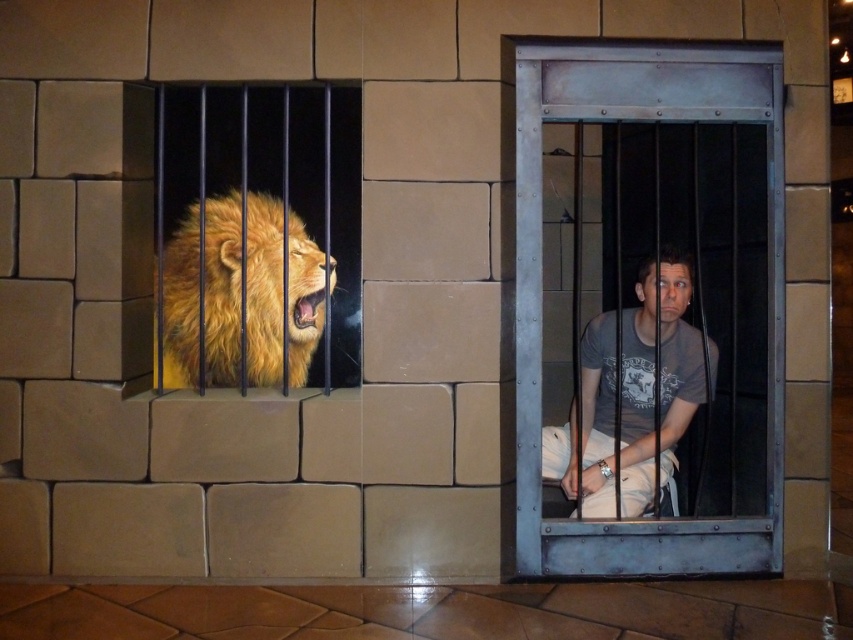
Does golden fur lion at left have a lesser width compared to matte gray t-shirt at center?

Indeed, golden fur lion at left has a lesser width compared to matte gray t-shirt at center.

Is point (210, 324) positioned in front of point (712, 356)?

Yes, point (210, 324) is closer to viewer.

Who is more distant from viewer, (190, 289) or (676, 284)?

Point (676, 284)

I want to click on golden fur lion at left, so click(263, 291).

Does metallic steel bars at center appear on the left side of matte gray t-shirt at center?

Correct, you'll find metallic steel bars at center to the left of matte gray t-shirt at center.

Does point (758, 45) lie in front of point (645, 332)?

Yes, point (758, 45) is closer to viewer.

Between point (668, 237) and point (714, 348), which one is positioned behind?

Point (668, 237)

Where is `metallic steel bars at center`? This screenshot has width=853, height=640. metallic steel bars at center is located at coordinates click(653, 307).

Is point (729, 154) positioned before point (260, 296)?

No, it is not.

Which of these two, metallic steel bars at center or golden fur lion at left, stands shorter?

golden fur lion at left

Which is behind, point (572, 188) or point (250, 262)?

Positioned behind is point (572, 188).

I want to click on metallic steel bars at center, so click(653, 307).